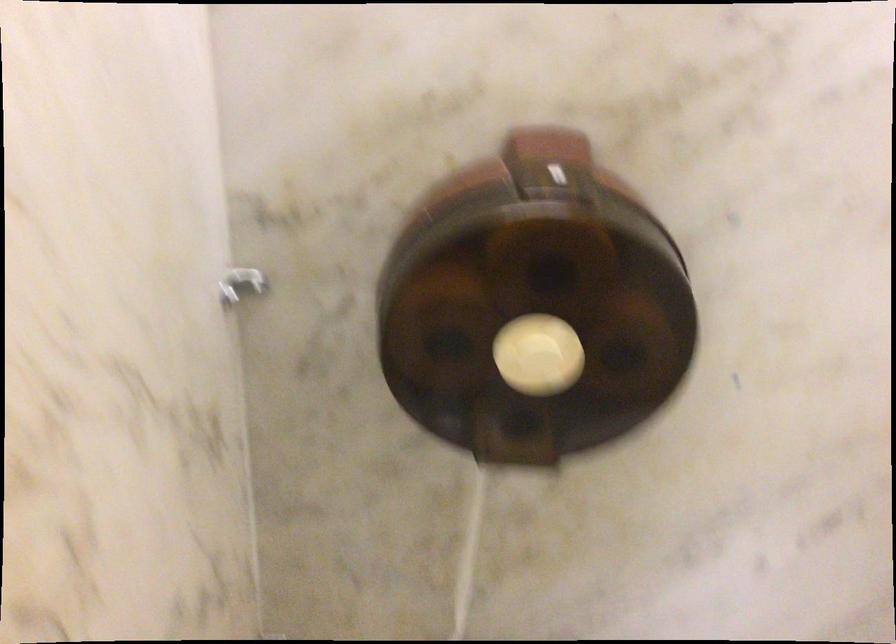
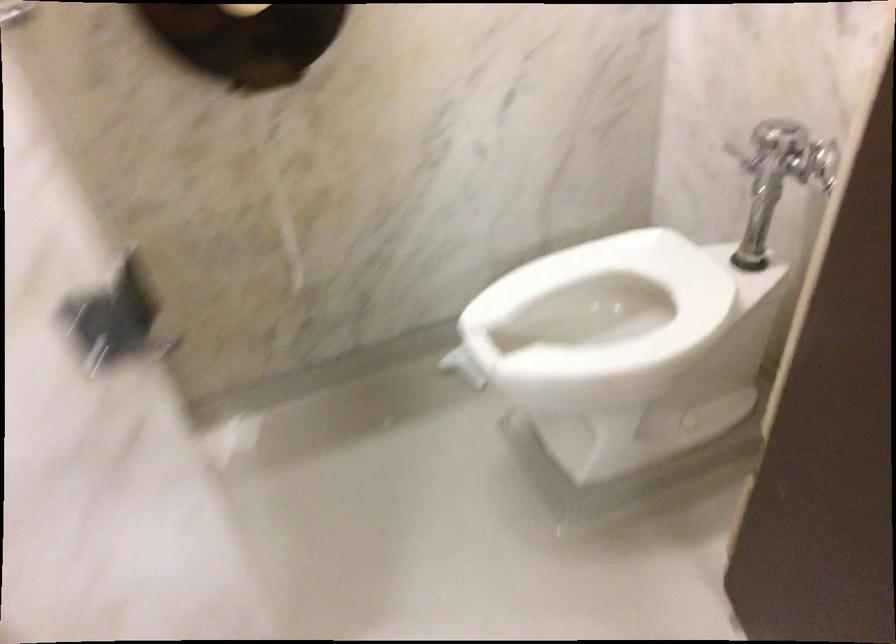
Question: The first image is from the beginning of the video and the second image is from the end. How did the camera likely rotate when shooting the video?

Choices:
 (A) Left
 (B) Right
 (C) Up
 (D) Down

Answer: (B)